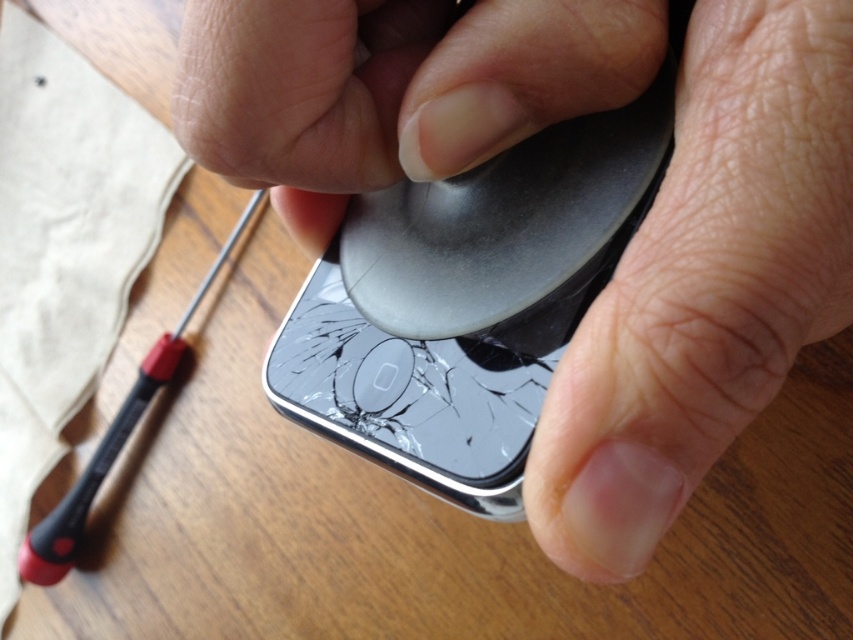
Where is the smooth matte black phone at center located in the image?

The smooth matte black phone at center is located at point (392, 88).

You are trying to fix the phone with a cracked screen. The point you are focusing on is at coordinate (705, 284). Which object is located at this point?

The point at coordinate (705, 284) corresponds to the metallic gray phone at center.